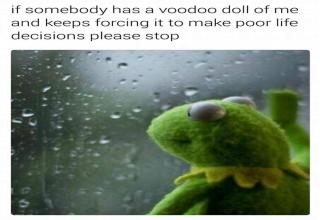
Find the location of `window`. window is located at coordinates (141, 163).